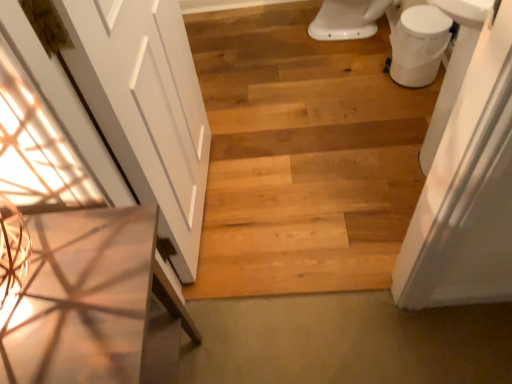
Where is `free space between natural wood plank at center and white glossy toilet bowl at upper right`? free space between natural wood plank at center and white glossy toilet bowl at upper right is located at coordinates (334, 215).